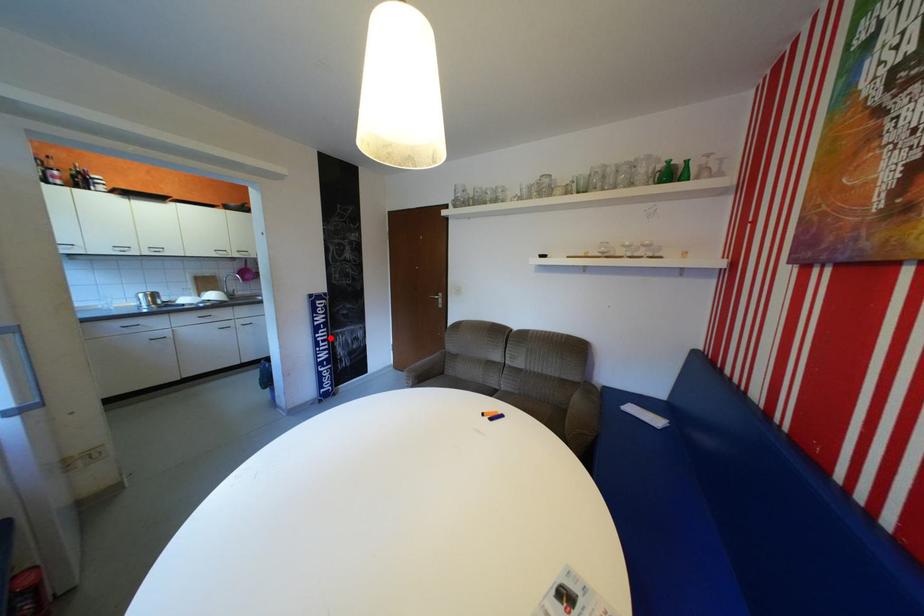
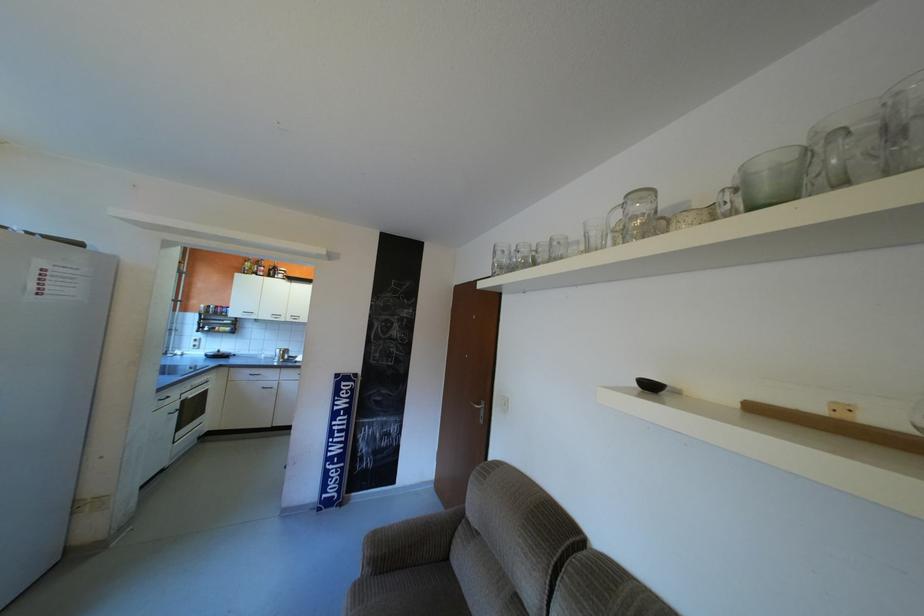
Locate, in the second image, the point that corresponds to the highlighted location in the first image.

(346, 427)